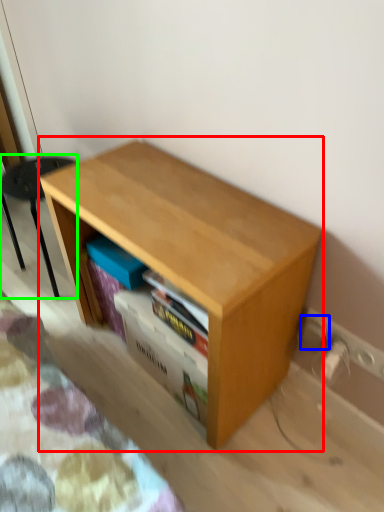
Question: Which object is the closest to the table (highlighted by a red box)? Choose among these: electric outlet (highlighted by a blue box) or furniture (highlighted by a green box).

Choices:
 (A) electric outlet
 (B) furniture

Answer: (A)